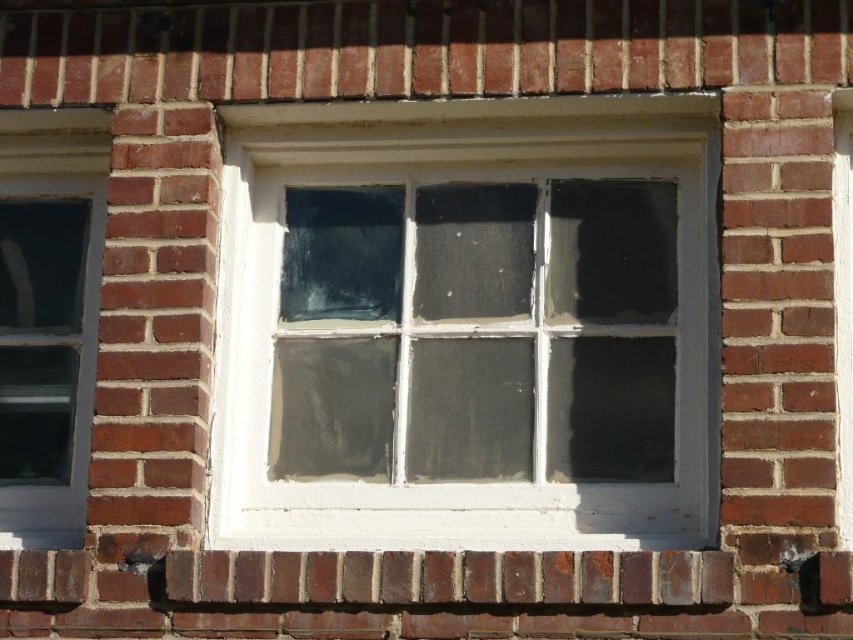
Question: Which point is farther from the camera taking this photo?

Choices:
 (A) (0, 541)
 (B) (224, 321)

Answer: (B)

Question: Is white painted wood window frame at center behind clear glass window at left?

Choices:
 (A) no
 (B) yes

Answer: (A)

Question: Is white painted wood window frame at center in front of clear glass window at left?

Choices:
 (A) no
 (B) yes

Answer: (B)

Question: Does white painted wood window frame at center have a lesser width compared to clear glass window at left?

Choices:
 (A) yes
 (B) no

Answer: (B)